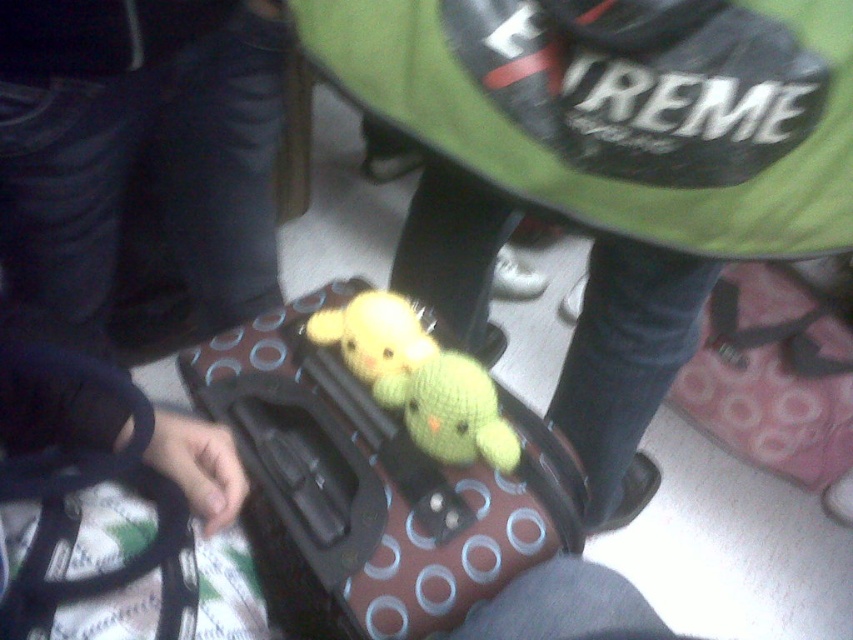
Question: Can you confirm if green knitted toy at center is thinner than knitted yellow toy at center?

Choices:
 (A) no
 (B) yes

Answer: (A)

Question: Estimate the real-world distances between objects in this image. Which object is farther from the brown polka dot suitcase at center?

Choices:
 (A) knitted yellow toy at center
 (B) green knitted toy at center
 (C) yellow knitted toy at center

Answer: (B)

Question: Does brown polka dot suitcase at center have a smaller size compared to knitted yellow toy at center?

Choices:
 (A) no
 (B) yes

Answer: (A)

Question: Which of the following is the closest to the observer?

Choices:
 (A) (323, 621)
 (B) (480, 369)
 (C) (837, 42)
 (D) (416, 320)

Answer: (C)

Question: Which is farther from the brown polka dot suitcase at center?

Choices:
 (A) knitted yellow toy at center
 (B) green knitted toy at center
 (C) yellow knitted toy at center

Answer: (B)

Question: Does knitted yellow toy at center have a lesser width compared to yellow knitted toy at center?

Choices:
 (A) yes
 (B) no

Answer: (A)